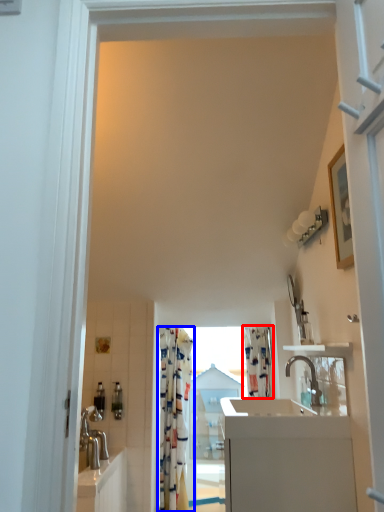
Question: Which of the following is the closest to the observer, shower curtain (highlighted by a red box) or curtain (highlighted by a blue box)?

Choices:
 (A) shower curtain
 (B) curtain

Answer: (B)